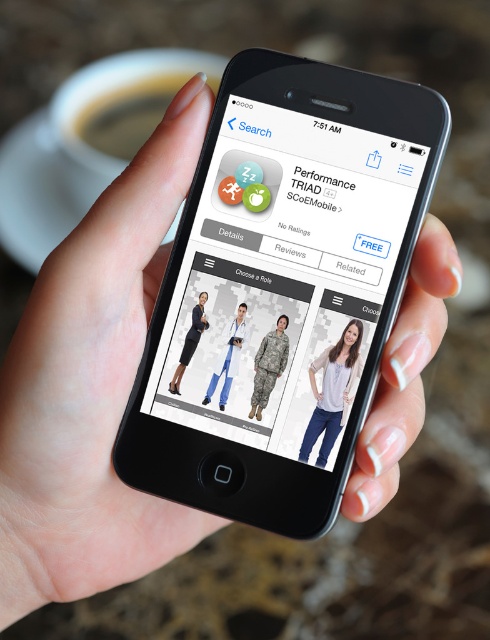
Question: Is the position of brown liquid at upper left less distant than that of light gray cotton shirt at center?

Choices:
 (A) no
 (B) yes

Answer: (A)

Question: Is brown liquid at upper left wider than light gray cotton shirt at center?

Choices:
 (A) no
 (B) yes

Answer: (B)

Question: Can you confirm if brown liquid at upper left is positioned below light gray cotton shirt at center?

Choices:
 (A) yes
 (B) no

Answer: (B)

Question: Among these points, which one is farthest from the camera?

Choices:
 (A) (228, 339)
 (B) (258, 406)

Answer: (A)

Question: Which of these objects is positioned farthest from the matte white coat at center?

Choices:
 (A) brown liquid at upper left
 (B) camouflage fabric uniform at center
 (C) matte black dress at center

Answer: (A)

Question: Which of the following is the closest to the observer?

Choices:
 (A) matte black dress at center
 (B) camouflage fabric uniform at center
 (C) brown liquid at upper left
 (D) matte white coat at center

Answer: (B)